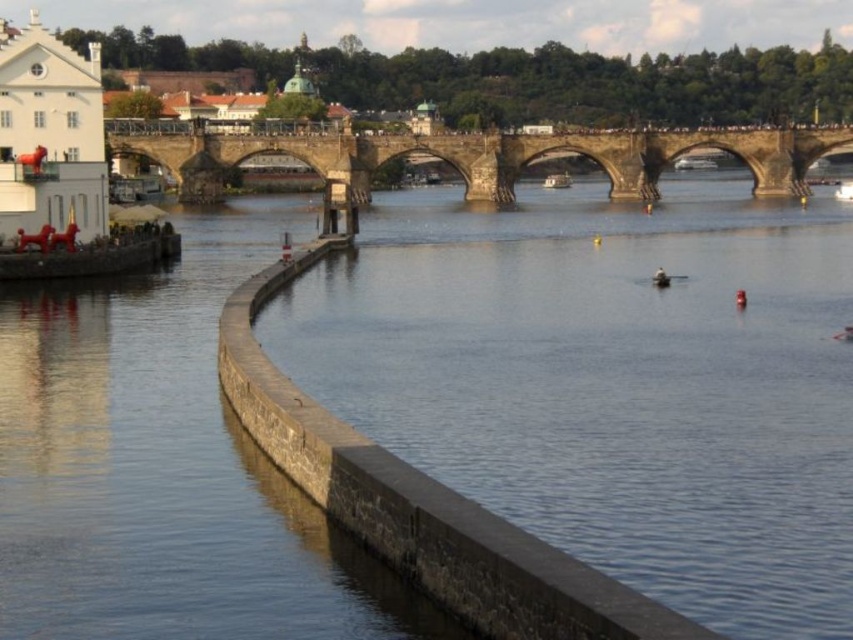
Question: Which point is farther from the camera taking this photo?

Choices:
 (A) (660, 282)
 (B) (560, 188)

Answer: (B)

Question: Which object is farther from the camera taking this photo?

Choices:
 (A) white plastic boat at center
 (B) stone bridge at center

Answer: (A)

Question: Is smooth wooden boat at center to the left of white matte person at center from the viewer's perspective?

Choices:
 (A) yes
 (B) no

Answer: (B)

Question: Can you confirm if clear blue water at center is positioned above smooth wooden boat at center?

Choices:
 (A) no
 (B) yes

Answer: (A)

Question: Which object appears closest to the camera in this image?

Choices:
 (A) stone bridge at center
 (B) white plastic boat at center
 (C) white matte person at center
 (D) smooth wooden boat at center

Answer: (C)

Question: Can you confirm if clear blue water at center is positioned to the left of smooth wooden boat at center?

Choices:
 (A) yes
 (B) no

Answer: (A)